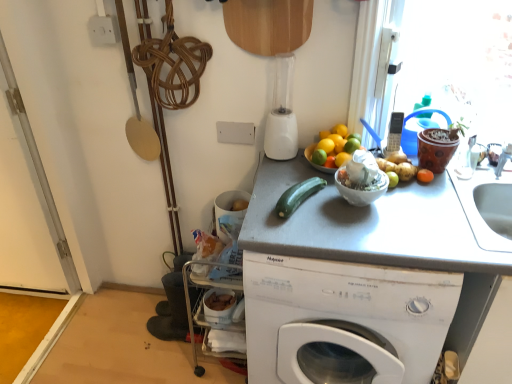
You are a GUI agent. You are given a task and a screenshot of the screen. Output one action in this format:
    pyautogui.click(x=<x>, y=<y>)
    Task: Click on the vacant region to the right of white glossy bowl at center
    This screenshot has width=512, height=384.
    Given the screenshot: What is the action you would take?
    pyautogui.click(x=419, y=206)